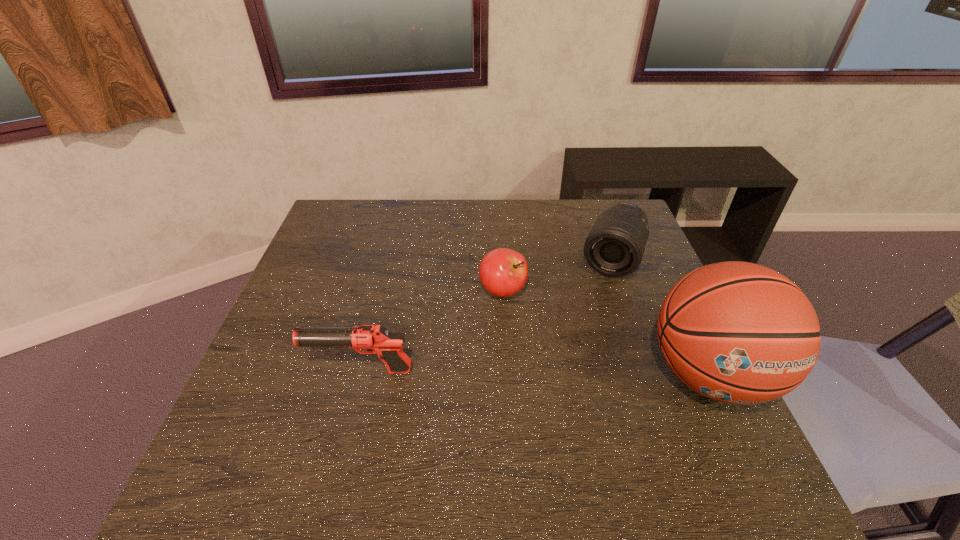
At what (x,y) coordinates should I click in order to perform the action: click on vacant area situated on the surface of the telephoto lens. Please return your answer as a coordinate pair (x, y). Image resolution: width=960 pixels, height=540 pixels. Looking at the image, I should click on (561, 393).

What are the coordinates of `object situated at the far edge` in the screenshot? It's located at (615, 246).

Identify the location of object present at the near edge. This screenshot has width=960, height=540. (740, 333).

Identify the location of object that is at the left edge. (377, 339).

Locate an element on the screen. basketball located in the right edge section of the desktop is located at coordinates (740, 333).

Identify the location of telephoto lens present at the right edge. The width and height of the screenshot is (960, 540). (615, 246).

In order to click on object that is at the far right corner in this screenshot , I will do `click(615, 246)`.

Where is `object at the near right corner`? This screenshot has width=960, height=540. object at the near right corner is located at coordinates (740, 333).

Identify the location of blank space at the far edge of the desktop. [x=476, y=215].

In the image, there is a desktop. Where is `vacant space at the left edge`? This screenshot has height=540, width=960. vacant space at the left edge is located at coordinates (311, 384).